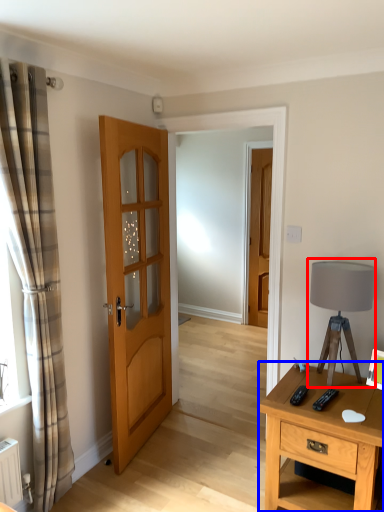
Question: Which point is closer to the camera, table lamp (highlighted by a red box) or nightstand (highlighted by a blue box)?

Choices:
 (A) table lamp
 (B) nightstand

Answer: (B)